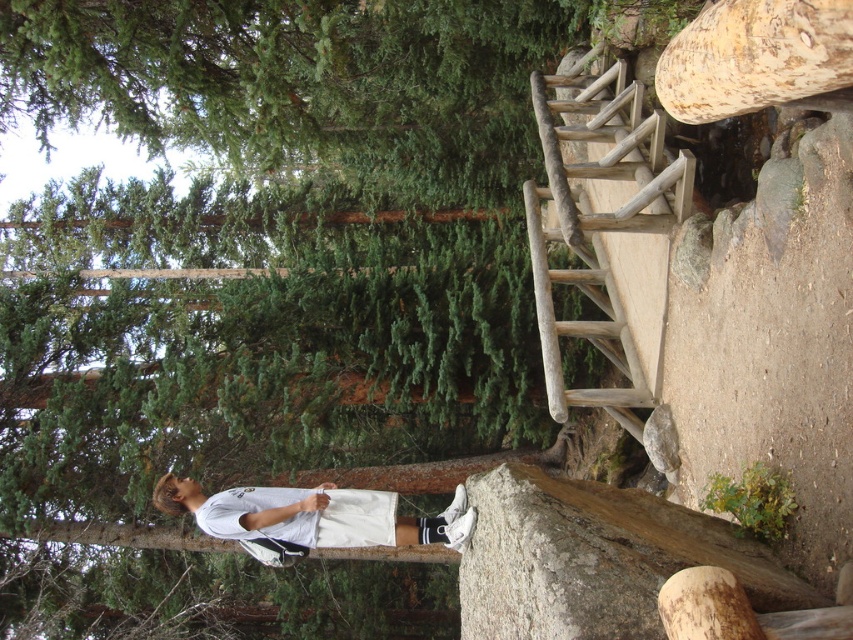
You are a hiker who needs to climb the natural wood ladder at upper right to reach a higher trail. However, you are wearing the white matte shorts at lower center. Do your shorts have a longer length than the ladder? Please explain.

The natural wood ladder at upper right has a smaller size compared to white matte shorts at lower center. Since the ladder is smaller in size, the white matte shorts at lower center are larger. Therefore, the shorts have a longer length than the ladder.

You are a photographer trying to capture a photo of the white matte shorts at lower center without the green matte tree trunk at center blocking the view. Can you adjust your position to achieve this?

The green matte tree trunk at center is much taller than the white matte shorts at lower center, so you can lower your camera angle to avoid the tree trunk blocking the view of the white matte shorts at lower center.

Based on the scene description, where is the green matte tree trunk at center located in terms of its 2D coordinates?

The green matte tree trunk at center is located at the 2D coordinates of point (271, 243).